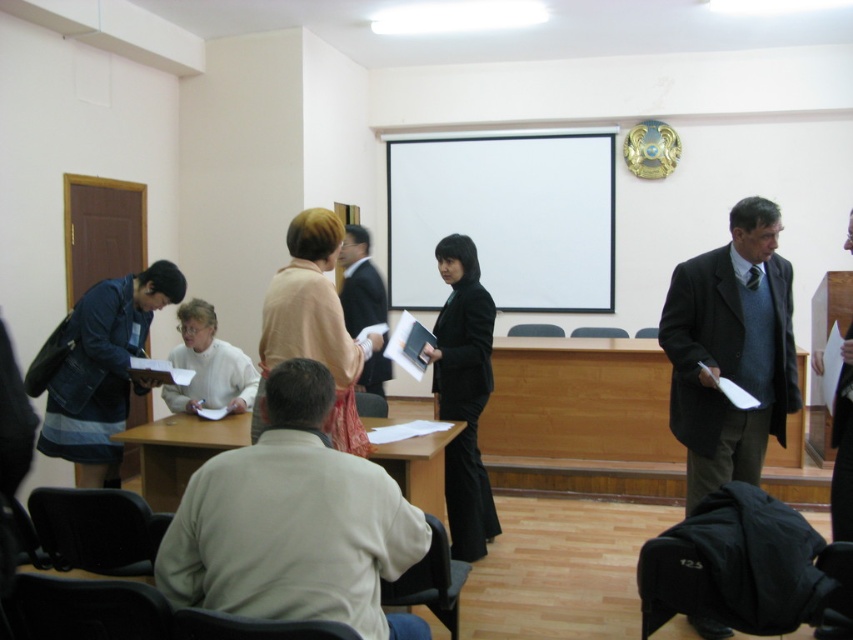
In the scene shown: You are organizing a photo shoot in this conference room and need to place a large backdrop behind the dark gray suit at right and denim skirt at left. Since the backdrop can only cover one of them, which one should you choose to ensure it fits properly?

The dark gray suit at right has a larger size compared to denim skirt at left, so the backdrop should be placed behind the dark gray suit at right to ensure it fits properly.

You are a guest speaker preparing to present your slides. You notice the white matte projector screen at upper center and the light beige sweater at center. Which object is positioned higher in the room?

The white matte projector screen at upper center is positioned higher than the light beige sweater at center.